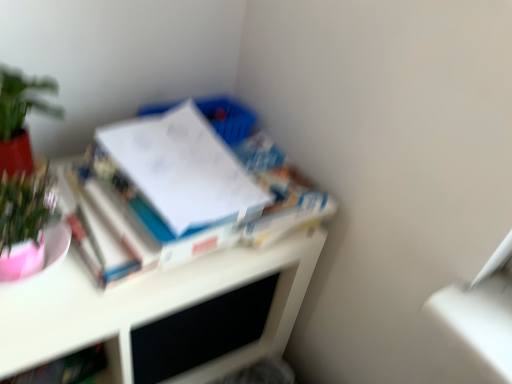
Measure the distance between hardcover book at lower left, arranged as the first book when viewed from the left, and camera.

The depth of hardcover book at lower left, arranged as the first book when viewed from the left, is 28.82 inches.

You are a GUI agent. You are given a task and a screenshot of the screen. Output one action in this format:
    pyautogui.click(x=<x>, y=<y>)
    Task: Click on the white glossy desk at upper left
    This screenshot has height=384, width=512.
    Given the screenshot: What is the action you would take?
    pyautogui.click(x=165, y=314)

Considering the relative positions of hardcover book at lower left, which is the first book in bottom-to-top order, and white glossy desk at upper left in the image provided, is hardcover book at lower left, which is the first book in bottom-to-top order, behind white glossy desk at upper left?

That is True.

From the image's perspective, who appears lower, hardcover book at lower left, placed as the 2th book when sorted from top to bottom, or white glossy desk at upper left?

hardcover book at lower left, placed as the 2th book when sorted from top to bottom, is shown below in the image.

This screenshot has width=512, height=384. I want to click on desk above the hardcover book at lower left, which is the 2th book from right to left (from the image's perspective), so click(x=165, y=314).

Is hardcover book at lower left, which is the first book in bottom-to-top order, positioned far away from white glossy desk at upper left?

A: That's not correct — hardcover book at lower left, which is the first book in bottom-to-top order, is a little close to white glossy desk at upper left.

Is white glossy book at upper left, the 1th book positioned from the top, oriented towards hardcover book at lower left, which is the 2th book from right to left?

No, white glossy book at upper left, the 1th book positioned from the top, is not oriented towards hardcover book at lower left, which is the 2th book from right to left.

You are a GUI agent. You are given a task and a screenshot of the screen. Output one action in this format:
    pyautogui.click(x=<x>, y=<y>)
    Task: Click on the book in front of the hardcover book at lower left, placed as the 2th book when sorted from top to bottom
    The height and width of the screenshot is (384, 512).
    Given the screenshot: What is the action you would take?
    pyautogui.click(x=183, y=194)

How much distance is there between white glossy book at upper left, acting as the 2th book starting from the bottom, and hardcover book at lower left, placed as the 2th book when sorted from top to bottom?

white glossy book at upper left, acting as the 2th book starting from the bottom, is 16.25 inches from hardcover book at lower left, placed as the 2th book when sorted from top to bottom.

Starting from the green matte plant at upper left, which book is the 2nd one to the right? Please provide its 2D coordinates.

[(183, 194)]

From the image's perspective, is green matte plant at upper left located above or below white glossy book at upper left, the 1th book positioned from the top?

Based on their image positions, green matte plant at upper left is located above white glossy book at upper left, the 1th book positioned from the top.

Is green matte plant at upper left positioned with its back to white glossy book at upper left, the 1th book positioned from the top?

No, white glossy book at upper left, the 1th book positioned from the top, is not at the back of green matte plant at upper left.

Can you tell me how much green matte plant at upper left and white glossy desk at upper left differ in facing direction?

They differ by 4.81 degrees in their facing directions.

Can you confirm if green matte plant at upper left is positioned to the right of white glossy desk at upper left?

Incorrect, green matte plant at upper left is not on the right side of white glossy desk at upper left.

Is green matte plant at upper left oriented towards white glossy desk at upper left?

No, green matte plant at upper left is not facing towards white glossy desk at upper left.

From the image's perspective, does green matte plant at upper left appear lower than white glossy desk at upper left?

Incorrect, from the image's perspective, green matte plant at upper left is higher than white glossy desk at upper left.

Between point (57, 339) and point (28, 173), which one is positioned behind?

The point (28, 173) is farther from the camera.

Choose the correct answer: Is white glossy desk at upper left inside green matte plant at upper left or outside it?

white glossy desk at upper left is not enclosed by green matte plant at upper left.

Which object is further away from the camera taking this photo, white glossy desk at upper left or green matte plant at upper left?

Positioned behind is green matte plant at upper left.

Is white glossy desk at upper left in contact with green matte plant at upper left?

white glossy desk at upper left is not next to green matte plant at upper left, and they're not touching.

Between white glossy book at upper left, the second book when ordered from left to right, and white glossy desk at upper left, which one is positioned in front?

white glossy desk at upper left is in front.

Can you confirm if white glossy book at upper left, acting as the 2th book starting from the bottom, is smaller than white glossy desk at upper left?

Indeed, white glossy book at upper left, acting as the 2th book starting from the bottom, has a smaller size compared to white glossy desk at upper left.

Is white glossy book at upper left, the first book in the right-to-left sequence, completely or partially outside of white glossy desk at upper left?

Yes, white glossy book at upper left, the first book in the right-to-left sequence, is located beyond the bounds of white glossy desk at upper left.

Is white glossy book at upper left, the first book in the right-to-left sequence, oriented towards white glossy desk at upper left?

No, white glossy book at upper left, the first book in the right-to-left sequence, is not facing towards white glossy desk at upper left.

Does white glossy book at upper left, the first book in the right-to-left sequence, have a greater height compared to green matte plant at upper left?

Incorrect, the height of white glossy book at upper left, the first book in the right-to-left sequence, is not larger of that of green matte plant at upper left.

From a real-world perspective, between white glossy book at upper left, the second book when ordered from left to right, and green matte plant at upper left, who is vertically higher?

green matte plant at upper left is physically above.

Is white glossy book at upper left, the first book in the right-to-left sequence, oriented towards green matte plant at upper left?

No, white glossy book at upper left, the first book in the right-to-left sequence, is not oriented towards green matte plant at upper left.

Is white glossy book at upper left, acting as the 2th book starting from the bottom, next to green matte plant at upper left and touching it?

No, white glossy book at upper left, acting as the 2th book starting from the bottom, is not making contact with green matte plant at upper left.

This screenshot has width=512, height=384. Identify the location of desk above the hardcover book at lower left, which is the 2th book from right to left (from the image's perspective). (165, 314).

Find the location of a particular element. book in front of the hardcover book at lower left, which is the first book in bottom-to-top order is located at coordinates (183, 194).

Estimate the real-world distances between objects in this image. Which object is further from green matte plant at upper left, white glossy book at upper left, the second book when ordered from left to right, or white glossy desk at upper left?

white glossy desk at upper left is further to green matte plant at upper left.

Based on their spatial positions, is white glossy book at upper left, the second book when ordered from left to right, or hardcover book at lower left, placed as the 2th book when sorted from top to bottom, further from white glossy desk at upper left?

Among the two, hardcover book at lower left, placed as the 2th book when sorted from top to bottom, is located further to white glossy desk at upper left.

Looking at the image, which one is located further to white glossy desk at upper left, green matte plant at upper left or white glossy book at upper left, the first book in the right-to-left sequence?

The object further to white glossy desk at upper left is green matte plant at upper left.

Considering their positions, is hardcover book at lower left, arranged as the first book when viewed from the left, positioned further to white glossy book at upper left, the first book in the right-to-left sequence, than green matte plant at upper left?

Among the two, hardcover book at lower left, arranged as the first book when viewed from the left, is located further to white glossy book at upper left, the first book in the right-to-left sequence.

When comparing their distances from hardcover book at lower left, which is the first book in bottom-to-top order, does green matte plant at upper left or white glossy desk at upper left seem further?

green matte plant at upper left is further to hardcover book at lower left, which is the first book in bottom-to-top order.

When comparing their distances from green matte plant at upper left, does hardcover book at lower left, placed as the 2th book when sorted from top to bottom, or white glossy book at upper left, acting as the 2th book starting from the bottom, seem further?

Among the two, hardcover book at lower left, placed as the 2th book when sorted from top to bottom, is located further to green matte plant at upper left.

Considering their positions, is white glossy desk at upper left positioned closer to hardcover book at lower left, arranged as the first book when viewed from the left, than green matte plant at upper left?

white glossy desk at upper left lies closer to hardcover book at lower left, arranged as the first book when viewed from the left, than the other object.

Estimate the real-world distances between objects in this image. Which object is closer to white glossy book at upper left, the first book in the right-to-left sequence, green matte plant at upper left or white glossy desk at upper left?

white glossy desk at upper left is closer to white glossy book at upper left, the first book in the right-to-left sequence.

Find the location of a particular element. This screenshot has width=512, height=384. desk that lies between white glossy book at upper left, the 1th book positioned from the top, and hardcover book at lower left, which is the first book in bottom-to-top order, from top to bottom is located at coordinates (165, 314).

At what (x,y) coordinates should I click in order to perform the action: click on book that lies between green matte plant at upper left and hardcover book at lower left, placed as the 2th book when sorted from top to bottom, from top to bottom. Please return your answer as a coordinate pair (x, y). Looking at the image, I should click on (183, 194).

Find the location of a particular element. Image resolution: width=512 pixels, height=384 pixels. book between green matte plant at upper left and white glossy desk at upper left in the vertical direction is located at coordinates (183, 194).

This screenshot has width=512, height=384. I want to click on desk that lies between green matte plant at upper left and hardcover book at lower left, which is the 2th book from right to left, from top to bottom, so click(x=165, y=314).